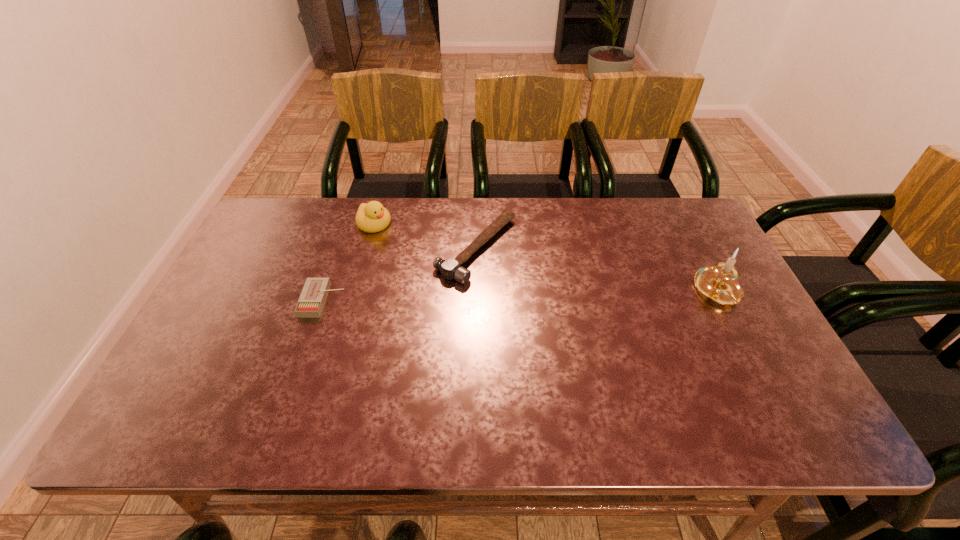
This screenshot has width=960, height=540. In order to click on vacant region between the third shortest object and the rightmost object in this screenshot , I will do [x=546, y=258].

Point out which object is positioned as the nearest to the tallest object. Please provide its 2D coordinates. Your answer should be formatted as a tuple, i.e. [(x, y)], where the tuple contains the x and y coordinates of a point satisfying the conditions above.

[(449, 268)]

The width and height of the screenshot is (960, 540). Identify the location of object that is the second nearest to the candle holder. (371, 217).

I want to click on vacant space that satisfies the following two spatial constraints: 1. on the front side of the second tallest object; 2. on the left side of the third object from left to right, so click(367, 249).

In order to click on vacant space that satisfies the following two spatial constraints: 1. on the front side of the second object from right to left; 2. on the right side of the third shortest object in this screenshot , I will do `click(367, 249)`.